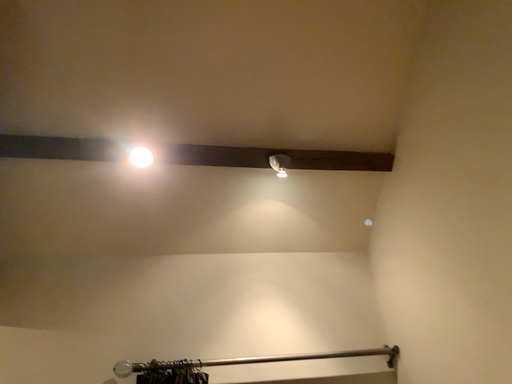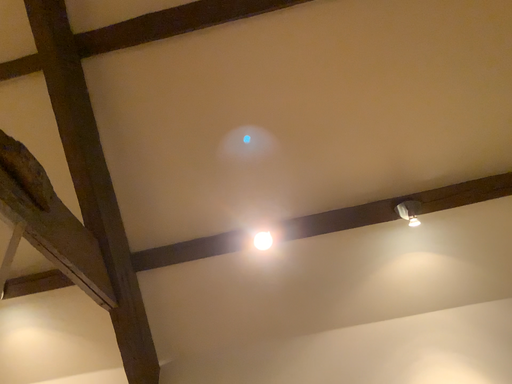
Question: Which way did the camera rotate in the video?

Choices:
 (A) rotated right
 (B) rotated left

Answer: (B)